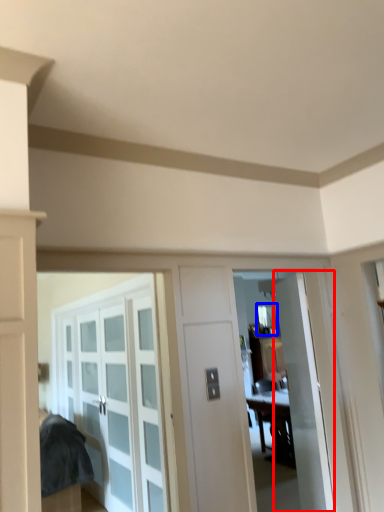
Question: Which of the following is the farthest to the observer, door (highlighted by a red box) or window (highlighted by a blue box)?

Choices:
 (A) door
 (B) window

Answer: (B)